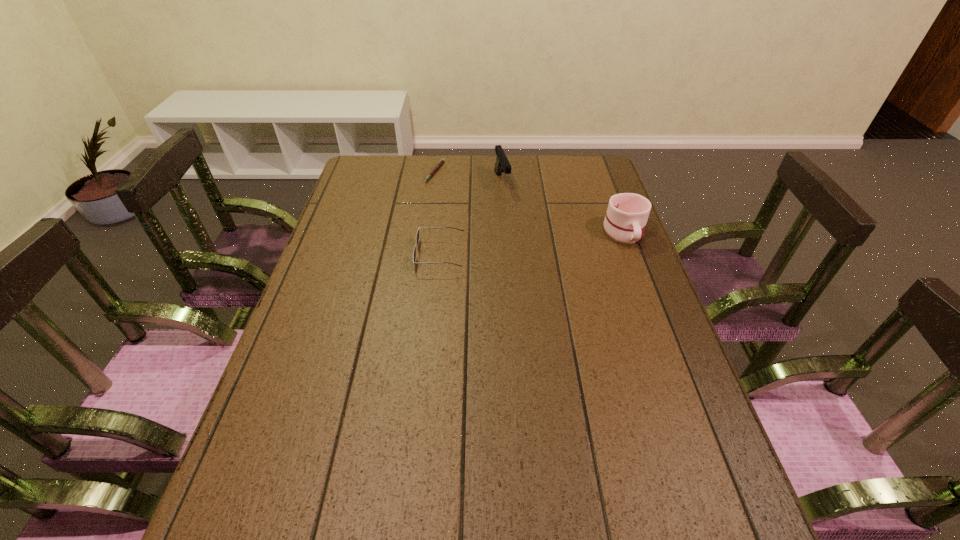
The height and width of the screenshot is (540, 960). I want to click on vacant space positioned 0.060m on the front-facing side of the second object from right to left, so click(x=509, y=204).

You are a GUI agent. You are given a task and a screenshot of the screen. Output one action in this format:
    pyautogui.click(x=<x>, y=<y>)
    Task: Click on the vacant space located 0.100m at the nib of the pen
    Image resolution: width=960 pixels, height=540 pixels.
    Given the screenshot: What is the action you would take?
    pyautogui.click(x=455, y=194)

This screenshot has height=540, width=960. I want to click on free location located 0.060m at the nib of the pen, so click(x=448, y=189).

Where is `vacant space located 0.340m at the nib of the pen`? This screenshot has width=960, height=540. vacant space located 0.340m at the nib of the pen is located at coordinates (499, 228).

Where is `pistol that is at the far edge`? The image size is (960, 540). pistol that is at the far edge is located at coordinates (502, 164).

Where is `pen that is at the far edge`? This screenshot has width=960, height=540. pen that is at the far edge is located at coordinates (442, 160).

Where is `object at the right edge`? object at the right edge is located at coordinates 627,213.

In the image, there is a desktop. Where is `vacant space at the far edge`? vacant space at the far edge is located at coordinates (451, 157).

I want to click on blank space at the near edge of the desktop, so click(x=550, y=462).

In the image, there is a desktop. Identify the location of vacant region at the left edge. (316, 291).